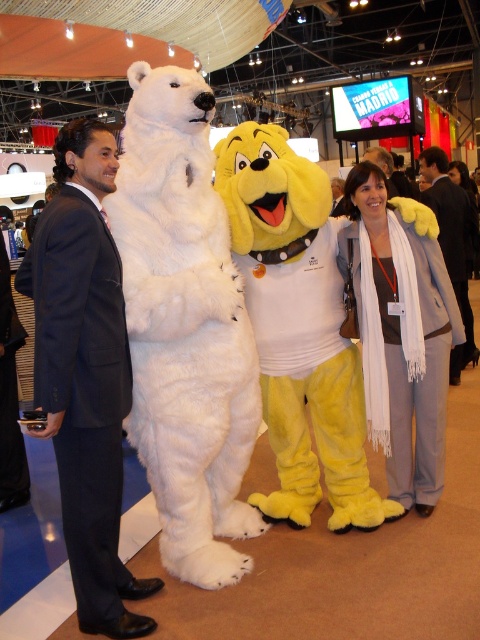
You are a photographer at the event and need to capture a photo of the white furry bear at left and the dark blue suit at left. The minimum distance required for your camera to focus properly is 12 inches. Will both subjects be in focus if they are positioned exactly as shown?

The white furry bear at left is 12.07 inches away from the dark blue suit at left. Since the distance between them is just over 12 inches, the camera should be able to focus on both subjects as they meet the minimum distance requirement.

You are at the convention and want to take a photo with the white furry bear at left. Where should you position yourself to ensure the bear is in the frame?

The white furry bear at left is located at point (184,326), so you should position yourself facing that coordinate to capture the bear in your photo.

Based on the scene description, where is the dark blue suit at left located in terms of coordinates?

The dark blue suit at left is located at coordinates point (84, 372).